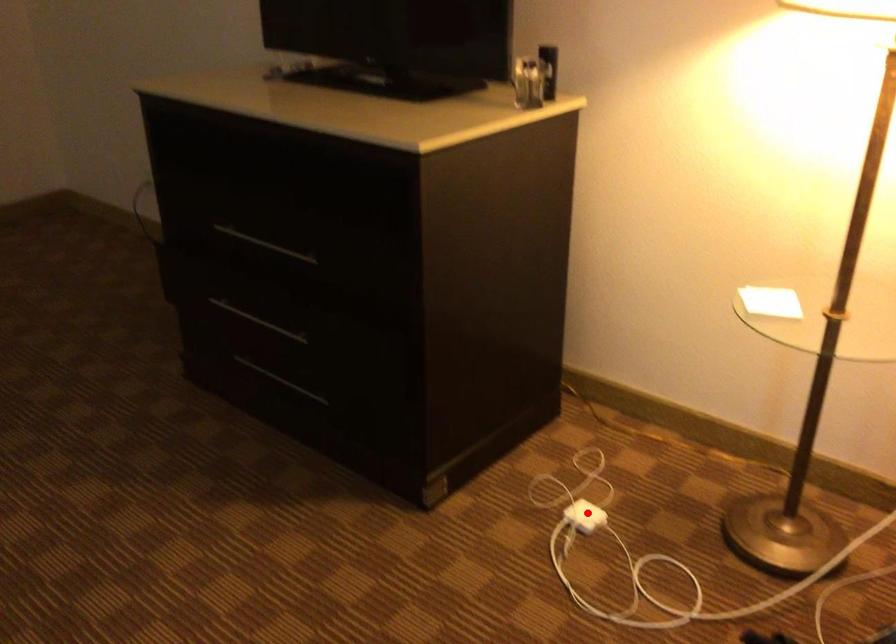
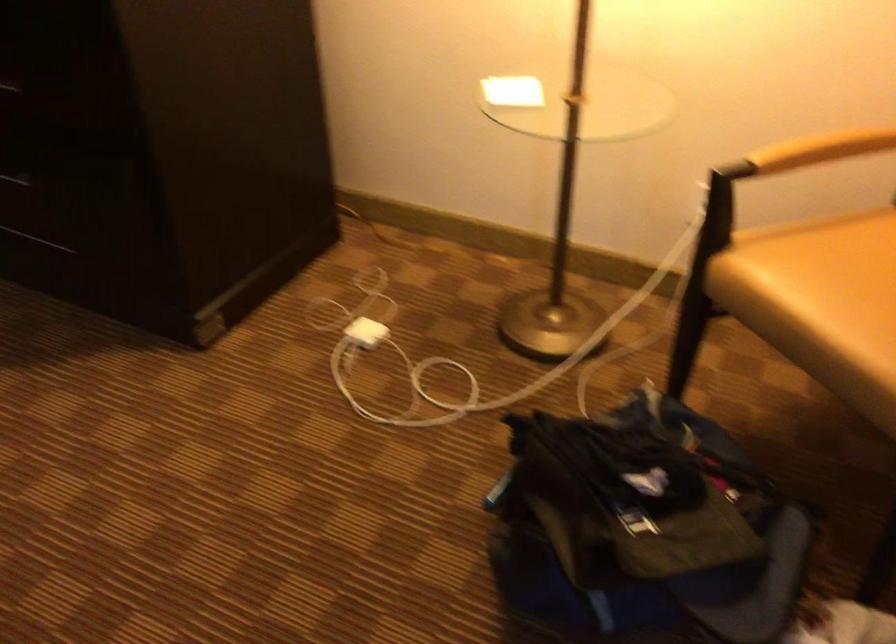
In the second image, find the point that corresponds to the highlighted location in the first image.

(366, 332)